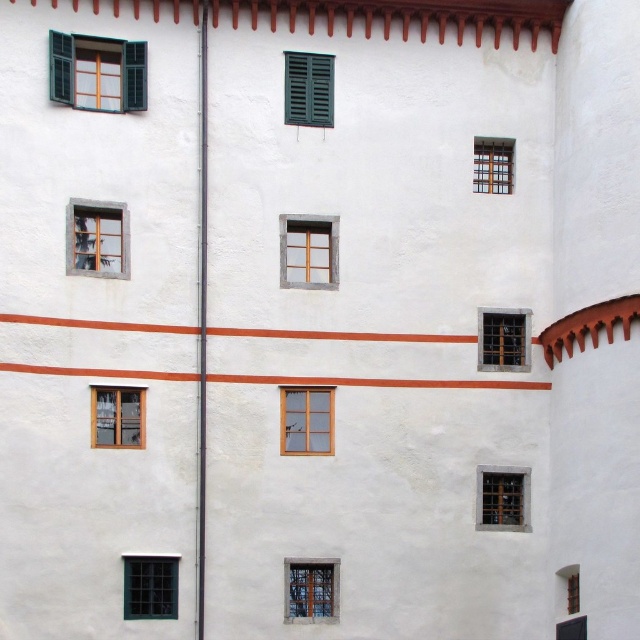
Question: Can you confirm if transparent glass window at upper left is thinner than matte glass window at lower right?

Choices:
 (A) yes
 (B) no

Answer: (B)

Question: Which point is farther to the camera?

Choices:
 (A) (324, 397)
 (B) (525, 506)
 (C) (97, 250)

Answer: (B)

Question: Which point is farther from the camera taking this photo?

Choices:
 (A) (477, 480)
 (B) (528, 353)

Answer: (B)

Question: Which point is closer to the camera taking this photo?

Choices:
 (A) (77, 218)
 (B) (294, 104)
 (C) (289, 444)

Answer: (A)

Question: Is green matte shutters at upper left behind wooden window at center?

Choices:
 (A) no
 (B) yes

Answer: (B)

Question: Can you confirm if clear glass window at center is positioned to the left of dark gray metal bars at right?

Choices:
 (A) no
 (B) yes

Answer: (B)